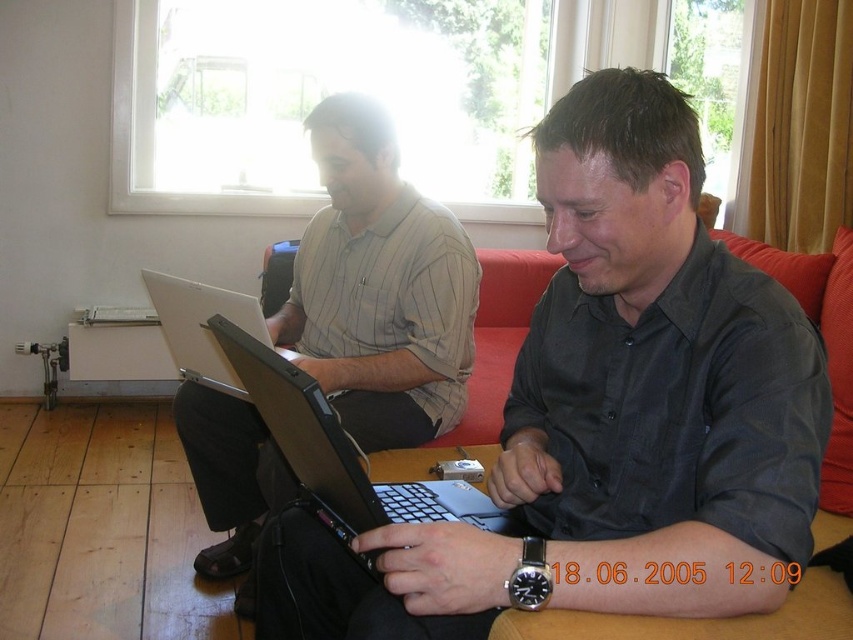
The width and height of the screenshot is (853, 640). In order to click on matte black laptop at center in this screenshot , I will do `click(607, 413)`.

Between matte black laptop at center and matte gray shirt at center, which one appears on the left side from the viewer's perspective?

matte gray shirt at center is more to the left.

Find the location of a particular element. The height and width of the screenshot is (640, 853). matte black laptop at center is located at coordinates (607, 413).

Image resolution: width=853 pixels, height=640 pixels. Identify the location of matte black laptop at center. (607, 413).

Who is shorter, matte black laptop at center or black matte laptop at center?

Standing shorter between the two is black matte laptop at center.

Is matte black laptop at center wider than black matte laptop at center?

Correct, the width of matte black laptop at center exceeds that of black matte laptop at center.

Who is more forward, (x=656, y=180) or (x=308, y=381)?

Point (x=308, y=381) is in front.

Find the location of a particular element. Image resolution: width=853 pixels, height=640 pixels. matte black laptop at center is located at coordinates (607, 413).

Who is shorter, black matte laptop at center or silver metallic laptop at center?

With less height is silver metallic laptop at center.

Who is more forward, (294, 467) or (254, 317)?

Point (294, 467) is more forward.

This screenshot has height=640, width=853. In order to click on black matte laptop at center in this screenshot , I will do `click(339, 451)`.